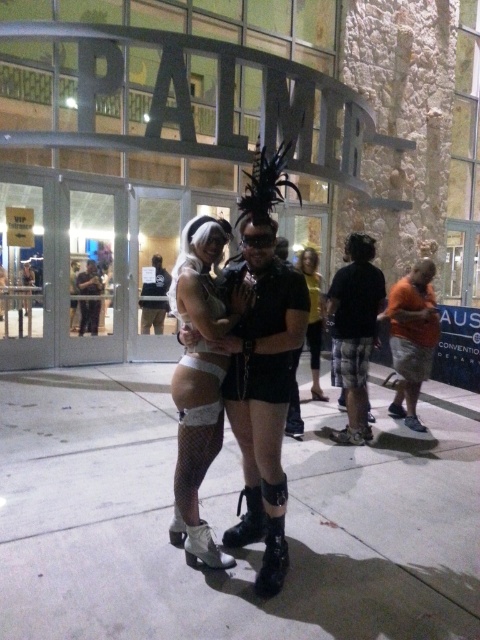
You are a photographer trying to capture a photo of the white fishnet stockings at center and the dark brown leather jacket at center. Based on their positions, which one should you focus on first if you want to include both in the frame without moving the camera?

The dark brown leather jacket at center should be focused on first because the white fishnet stockings at center is positioned to its right, so adjusting focus to the jacket ensures both are in frame without moving the camera.

You are a photographer at the event and want to capture a photo of the two people in the foreground. The camera you are using has a focus range that can only capture objects up to 1.2 meters in height. Given that the black leather boots at center and dark brown leather jacket at center are both within your camera frame, will both objects be in focus?

The black leather boots at center is taller than dark brown leather jacket at center. Since the camera can focus up to 1.2 meters, both objects will be in focus as long as their heights are within this range. However, without specific height measurements, we can only confirm that the taller object, the black leather boots at center, must be under 1.2 meters for both to be in focus.